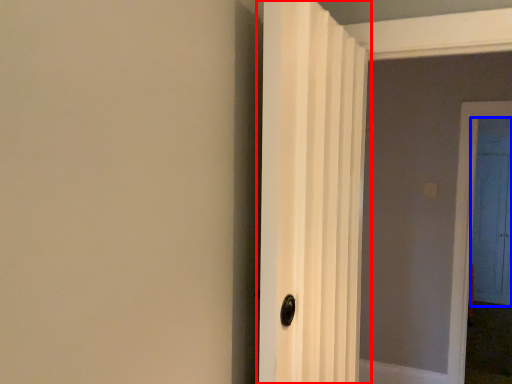
Question: Which object is further to the camera taking this photo, door (highlighted by a red box) or door (highlighted by a blue box)?

Choices:
 (A) door
 (B) door

Answer: (B)